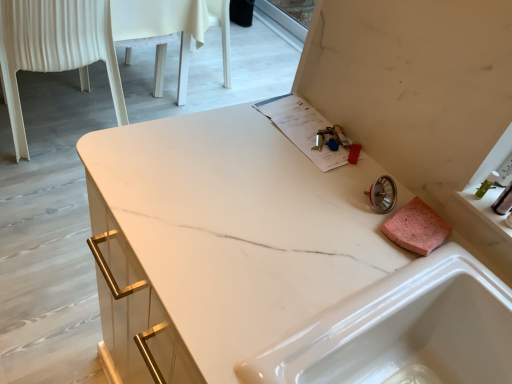
Question: From a real-world perspective, is translucent plastic container at right above or below white glossy sink at lower right?

Choices:
 (A) above
 (B) below

Answer: (A)

Question: Does point (502, 206) appear closer or farther from the camera than point (409, 284)?

Choices:
 (A) farther
 (B) closer

Answer: (A)

Question: Which object is positioned farthest from the white plastic chair at left?

Choices:
 (A) white glossy sink at lower right
 (B) translucent plastic container at right

Answer: (B)

Question: Estimate the real-world distances between objects in this image. Which object is farther from the white glossy sink at lower right?

Choices:
 (A) white plastic chair at left
 (B) translucent plastic container at right

Answer: (A)